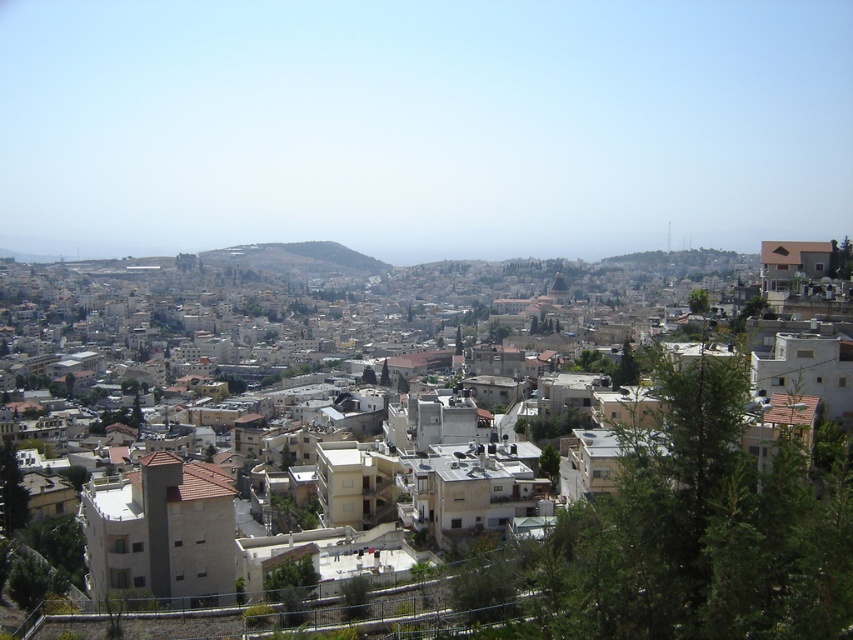
You are standing at the viewpoint looking at the urban area. There is a point marked at coordinates (x=317, y=300). What does this point indicate?

The point at (x=317, y=300) indicates beige stone buildings at center.

You are a city planner analyzing the image. You need to determine which area occupies more space in the scene between the beige stone buildings at center and the green grassy hillside at center. Which one is larger?

The beige stone buildings at center has a larger size compared to the green grassy hillside at center, so the beige stone buildings at center occupies more space in the scene.